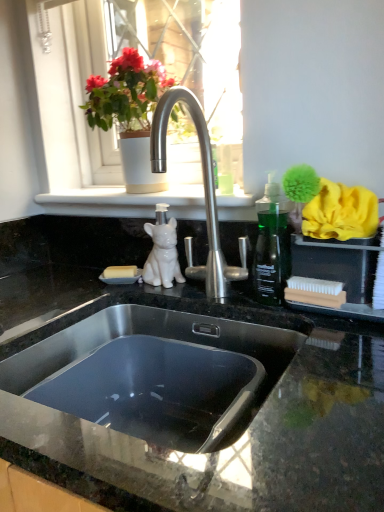
In order to click on white ceramic pot at upper center in this screenshot , I will do click(x=76, y=108).

Find the location of `white glossy dog at center`. white glossy dog at center is located at coordinates (162, 256).

You are a GUI agent. You are given a task and a screenshot of the screen. Output one action in this format:
    pyautogui.click(x=<x>, y=<y>)
    Task: Click on the stainless steel sink at center
    
    Given the screenshot: What is the action you would take?
    pyautogui.click(x=164, y=384)

Describe the element at coordinates (210, 344) in the screenshot. I see `black granite countertop at center` at that location.

The image size is (384, 512). Find the location of `white ceramic pot at upper center`. white ceramic pot at upper center is located at coordinates (76, 108).

Can you confirm if stainless steel sink at center is wider than white ceramic pot at upper center?

Correct, the width of stainless steel sink at center exceeds that of white ceramic pot at upper center.

In the image, is stainless steel sink at center positioned in front of or behind white ceramic pot at upper center?

Visually, stainless steel sink at center is located in front of white ceramic pot at upper center.

Considering the relative positions of stainless steel sink at center and white ceramic pot at upper center in the image provided, is stainless steel sink at center to the left of white ceramic pot at upper center from the viewer's perspective?

In fact, stainless steel sink at center is to the right of white ceramic pot at upper center.

Can you confirm if stainless steel sink at center is thinner than white glossy dog at center?

Incorrect, the width of stainless steel sink at center is not less than that of white glossy dog at center.

At what (x,y) coordinates should I click in order to perform the action: click on animal above the stainless steel sink at center (from a real-world perspective). Please return your answer as a coordinate pair (x, y). The height and width of the screenshot is (512, 384). Looking at the image, I should click on (162, 256).

Considering the sizes of objects stainless steel sink at center and white glossy dog at center in the image provided, who is taller, stainless steel sink at center or white glossy dog at center?

stainless steel sink at center.

Identify the location of countertop on the right of the matte white pot at upper center. This screenshot has width=384, height=512. (210, 344).

How much distance is there between black granite countertop at center and matte white pot at upper center?

black granite countertop at center is 14.56 inches from matte white pot at upper center.

Considering the positions of objects black granite countertop at center and matte white pot at upper center in the image provided, who is behind, black granite countertop at center or matte white pot at upper center?

matte white pot at upper center is further from the camera.

From a real-world perspective, is black granite countertop at center on top of matte white pot at upper center?

No.

Between white ceramic pot at upper center and stainless steel sink at center, which one has larger width?

stainless steel sink at center is wider.

Which is closer, (73, 102) or (23, 353)?

Clearly, point (73, 102) is more distant from the camera than point (23, 353).

Could you tell me if white ceramic pot at upper center is facing stainless steel sink at center?

No, white ceramic pot at upper center is not turned towards stainless steel sink at center.

Is white ceramic pot at upper center to the right of stainless steel sink at center from the viewer's perspective?

No.

From a real-world perspective, which object stands above the other?

From a 3D spatial view, matte white pot at upper center is above.

Considering the sizes of matte white pot at upper center and stainless steel sink at center in the image, is matte white pot at upper center bigger or smaller than stainless steel sink at center?

Considering their sizes, matte white pot at upper center takes up less space than stainless steel sink at center.

From the image's perspective, is matte white pot at upper center located beneath stainless steel sink at center?

No, from the image's perspective, matte white pot at upper center is not beneath stainless steel sink at center.

Is matte white pot at upper center not close to stainless steel sink at center?

No.

Would you say matte white pot at upper center is part of white glossy dog at center's contents?

No, matte white pot at upper center is not a part of white glossy dog at center.

Is white glossy dog at center directly adjacent to matte white pot at upper center?

white glossy dog at center and matte white pot at upper center are not in contact.

Who is smaller, white glossy dog at center or matte white pot at upper center?

white glossy dog at center is smaller.

From the image's perspective, is white glossy dog at center positioned above or below black granite countertop at center?

Based on their image positions, white glossy dog at center is located above black granite countertop at center.

Does white glossy dog at center have a greater width compared to black granite countertop at center?

In fact, white glossy dog at center might be narrower than black granite countertop at center.

Which object is more forward, white glossy dog at center or black granite countertop at center?

black granite countertop at center is in front.

From the picture: Can you tell me how much white glossy dog at center and black granite countertop at center differ in facing direction?

The angle between the facing direction of white glossy dog at center and the facing direction of black granite countertop at center is 0.523 degrees.

Where is `window lying behind the stainless steel sink at center`? The image size is (384, 512). window lying behind the stainless steel sink at center is located at coordinates (76, 108).

Locate an element on the screen. sink located on the right of white glossy dog at center is located at coordinates (164, 384).

When comparing their distances from black granite countertop at center, does stainless steel sink at center or white glossy dog at center seem further?

The object further to black granite countertop at center is white glossy dog at center.

In the scene shown: Based on their spatial positions, is white glossy dog at center or matte white pot at upper center further from stainless steel sink at center?

Among the two, matte white pot at upper center is located further to stainless steel sink at center.

Which object lies nearer to the anchor point matte white pot at upper center, white ceramic pot at upper center or stainless steel sink at center?

white ceramic pot at upper center is positioned closer to the anchor matte white pot at upper center.

Considering their positions, is white ceramic pot at upper center positioned further to black granite countertop at center than matte white pot at upper center?

matte white pot at upper center lies further to black granite countertop at center than the other object.

Consider the image. Looking at the image, which one is located further to matte white pot at upper center, black granite countertop at center or white ceramic pot at upper center?

black granite countertop at center lies further to matte white pot at upper center than the other object.

Which object lies nearer to the anchor point white ceramic pot at upper center, white glossy dog at center or stainless steel sink at center?

white glossy dog at center is closer to white ceramic pot at upper center.

From the image, which object appears to be farther from black granite countertop at center, matte white pot at upper center or white ceramic pot at upper center?

matte white pot at upper center.

When comparing their distances from stainless steel sink at center, does black granite countertop at center or white glossy dog at center seem further?

white glossy dog at center lies further to stainless steel sink at center than the other object.

Find the location of `houseplant between white ceramic pot at upper center and black granite countertop at center from top to bottom`. houseplant between white ceramic pot at upper center and black granite countertop at center from top to bottom is located at coordinates (129, 113).

Identify the location of animal between white ceramic pot at upper center and black granite countertop at center from top to bottom. (162, 256).

Identify the location of houseplant between white ceramic pot at upper center and white glossy dog at center in the up-down direction. The image size is (384, 512). pos(129,113).

This screenshot has width=384, height=512. I want to click on animal between matte white pot at upper center and stainless steel sink at center in the vertical direction, so click(162, 256).